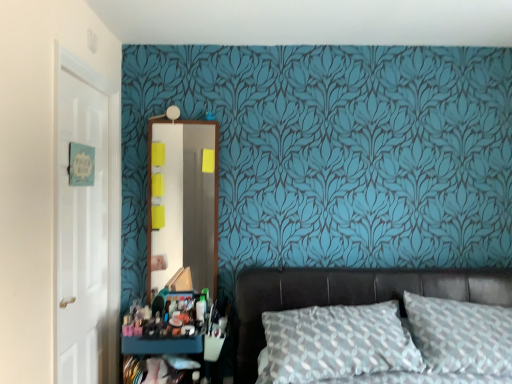
Question: Is white glossy door at left wider or thinner than leather bed at lower right?

Choices:
 (A) wide
 (B) thin

Answer: (B)

Question: From the image's perspective, is white glossy door at left above or below leather bed at lower right?

Choices:
 (A) below
 (B) above

Answer: (B)

Question: Based on their relative distances, which object is nearer to the textured gray pillow at center?

Choices:
 (A) matte plastic makeup at lower left
 (B) white glossy door at left
 (C) wooden mirror at center
 (D) leather bed at lower right
 (E) matte black dresser at lower left

Answer: (D)

Question: Considering the real-world distances, which object is farthest from the wooden mirror at center?

Choices:
 (A) textured gray pillow at center
 (B) leather bed at lower right
 (C) white glossy door at left
 (D) matte black dresser at lower left
 (E) matte plastic makeup at lower left

Answer: (A)